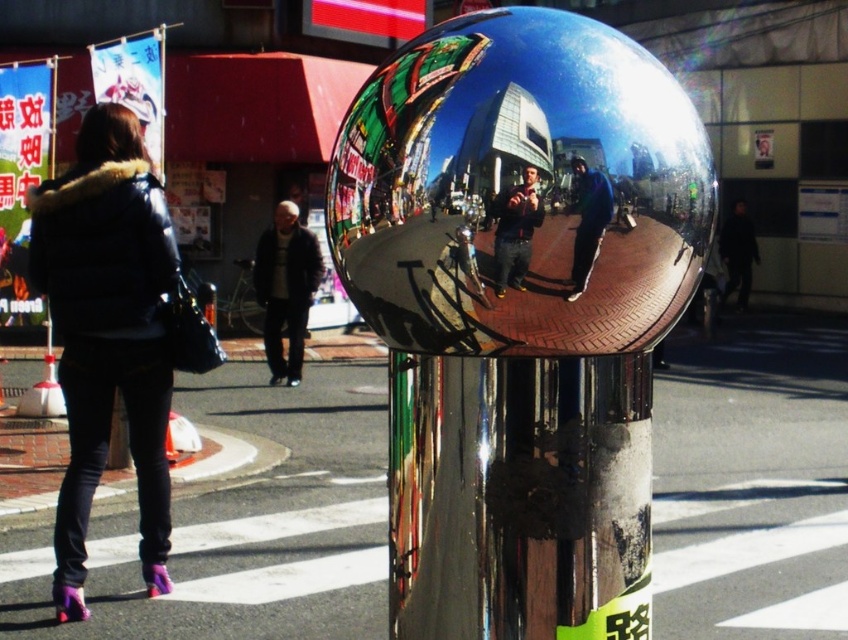
Based on the photo, you are a pedestrian trying to cross the street and need to know if the dark blue jeans at center and the blue reflective jacket at center are close enough to be considered part of the same outfit. Given that the acceptable distance between clothing items for a coordinated outfit is 2 inches, can they be considered part of the same outfit?

The dark blue jeans at center is 3.05 inches away from blue reflective jacket at center, which exceeds the 2 inches threshold. Therefore, they cannot be considered part of the same outfit.

You are a fashion designer observing two jackets in an urban setting. The scene includes a matte black jacket at left and a dark gray fabric jacket at center. Which jacket appears taller in the image?

The matte black jacket at left appears taller than the dark gray fabric jacket at center in the image.

You are a pedestrian standing on the sidewalk and see both the matte black jacket at left and the blue reflective jacket at center. Which jacket is closer to you?

The matte black jacket at left is closer to you than the blue reflective jacket at center.